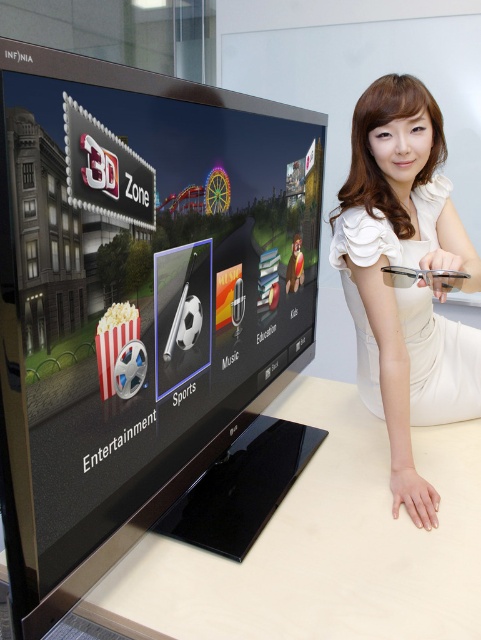
Can you confirm if white satin dress at right is bigger than white paper popcorn at center?

Indeed, white satin dress at right has a larger size compared to white paper popcorn at center.

Can you confirm if white satin dress at right is smaller than white paper popcorn at center?

Incorrect, white satin dress at right is not smaller in size than white paper popcorn at center.

Is point (379, 365) behind point (113, 320)?

Yes.

Locate an element on the screen. This screenshot has height=640, width=481. white satin dress at right is located at coordinates (407, 285).

I want to click on matte black soccer ball at center, so click(147, 314).

Which is more to the right, matte black soccer ball at center or white paper popcorn at center?

From the viewer's perspective, matte black soccer ball at center appears more on the right side.

The image size is (481, 640). Describe the element at coordinates (147, 314) in the screenshot. I see `matte black soccer ball at center` at that location.

In order to click on matte black soccer ball at center in this screenshot , I will do `click(147, 314)`.

Does matte black soccer ball at center appear on the left side of white glossy table at lower center?

Correct, you'll find matte black soccer ball at center to the left of white glossy table at lower center.

Which is behind, point (27, 253) or point (305, 550)?

The point (305, 550) is more distant.

Which is in front, point (283, 493) or point (473, 582)?

Point (473, 582) is more forward.

Identify the location of matte black soccer ball at center. The image size is (481, 640). (147, 314).